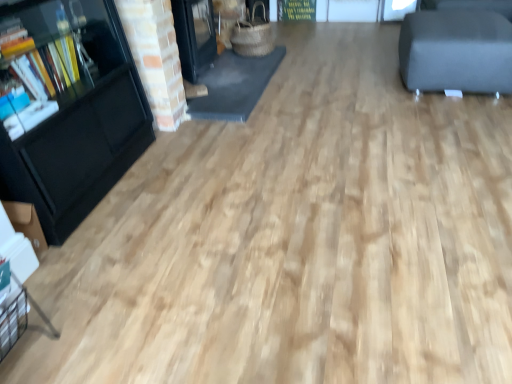
Question: Should I look upward or downward to see black glossy bookcase at left?

Choices:
 (A) down
 (B) up

Answer: (B)

Question: Is dark gray fabric ottoman at upper right oriented away from black glossy bookcase at left?

Choices:
 (A) no
 (B) yes

Answer: (A)

Question: Is dark gray fabric ottoman at upper right bigger than black glossy bookcase at left?

Choices:
 (A) no
 (B) yes

Answer: (A)

Question: Would you say dark gray fabric ottoman at upper right is a long distance from black glossy bookcase at left?

Choices:
 (A) no
 (B) yes

Answer: (B)

Question: Does dark gray fabric ottoman at upper right lie in front of black glossy bookcase at left?

Choices:
 (A) yes
 (B) no

Answer: (B)

Question: From a real-world perspective, is dark gray fabric ottoman at upper right physically above black glossy bookcase at left?

Choices:
 (A) no
 (B) yes

Answer: (A)

Question: Considering the relative sizes of dark gray fabric ottoman at upper right and black glossy bookcase at left in the image provided, is dark gray fabric ottoman at upper right thinner than black glossy bookcase at left?

Choices:
 (A) yes
 (B) no

Answer: (B)

Question: Is black glossy bookcase at left not within dark gray fabric ottoman at upper right?

Choices:
 (A) no
 (B) yes

Answer: (B)

Question: Is black glossy bookcase at left aimed at dark gray fabric ottoman at upper right?

Choices:
 (A) no
 (B) yes

Answer: (A)

Question: Is black glossy bookcase at left looking in the opposite direction of dark gray fabric ottoman at upper right?

Choices:
 (A) yes
 (B) no

Answer: (B)

Question: Does black glossy bookcase at left have a larger size compared to dark gray fabric ottoman at upper right?

Choices:
 (A) yes
 (B) no

Answer: (A)

Question: Considering the relative positions of black glossy bookcase at left and dark gray fabric ottoman at upper right in the image provided, is black glossy bookcase at left to the left of dark gray fabric ottoman at upper right from the viewer's perspective?

Choices:
 (A) yes
 (B) no

Answer: (A)

Question: Is black glossy bookcase at left placed right next to dark gray fabric ottoman at upper right?

Choices:
 (A) no
 (B) yes

Answer: (A)

Question: Does point (400, 72) appear closer or farther from the camera than point (55, 213)?

Choices:
 (A) closer
 (B) farther

Answer: (B)